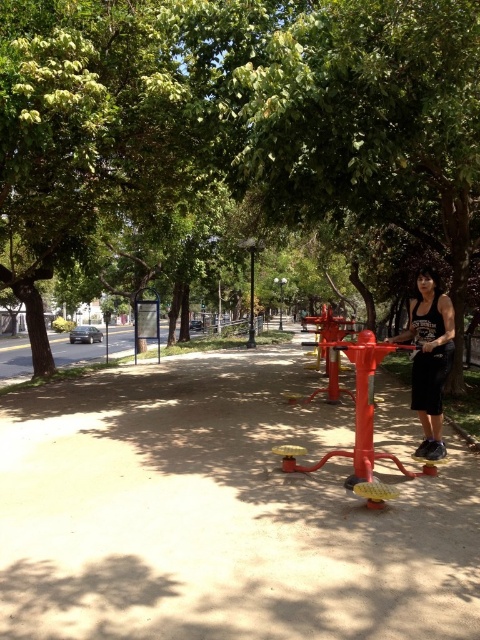
You are standing at the origin point in the image. Where is the matte concrete pavement at center located in terms of coordinates?

The matte concrete pavement at center is located at coordinates point (218, 515).

You are planning to install a new bench in the park. You want it to be placed where it can be shaded by the green leafy tree at center and also be close to the metallic pole at center. Given their sizes, which object should the bench be placed closer to?

The bench should be placed closer to the metallic pole at center because the green leafy tree at center is larger and can provide shade from a distance, while the bench needs to be near the pole for proximity.